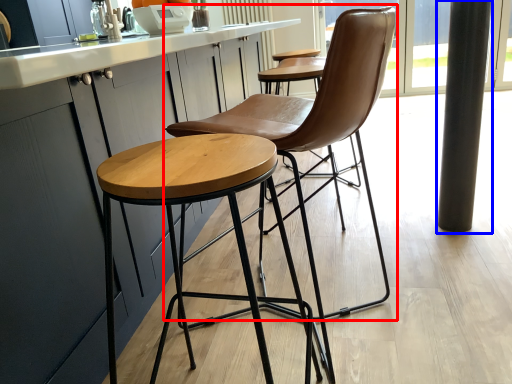
Question: Which object appears farthest to the camera in this image, chair (highlighted by a red box) or pillar (highlighted by a blue box)?

Choices:
 (A) chair
 (B) pillar

Answer: (B)